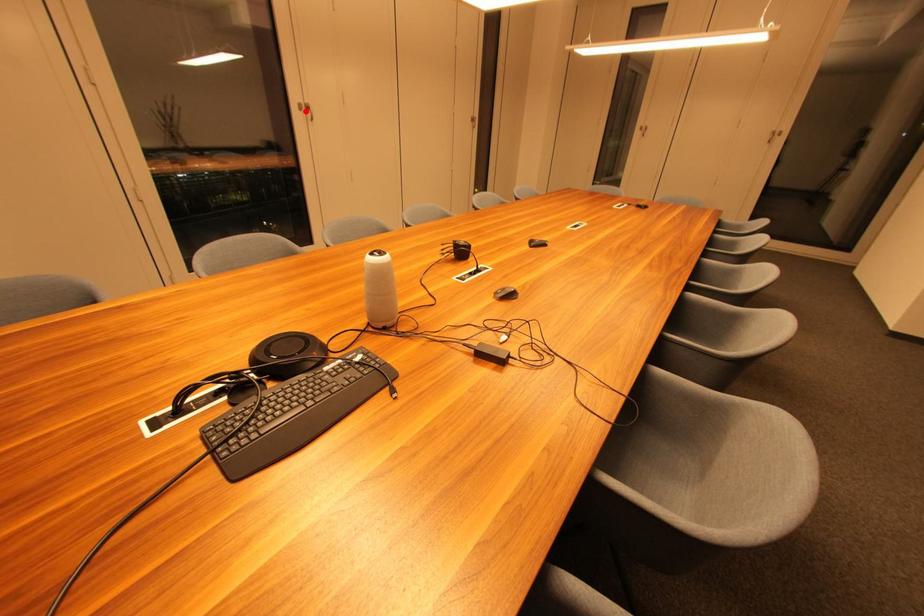
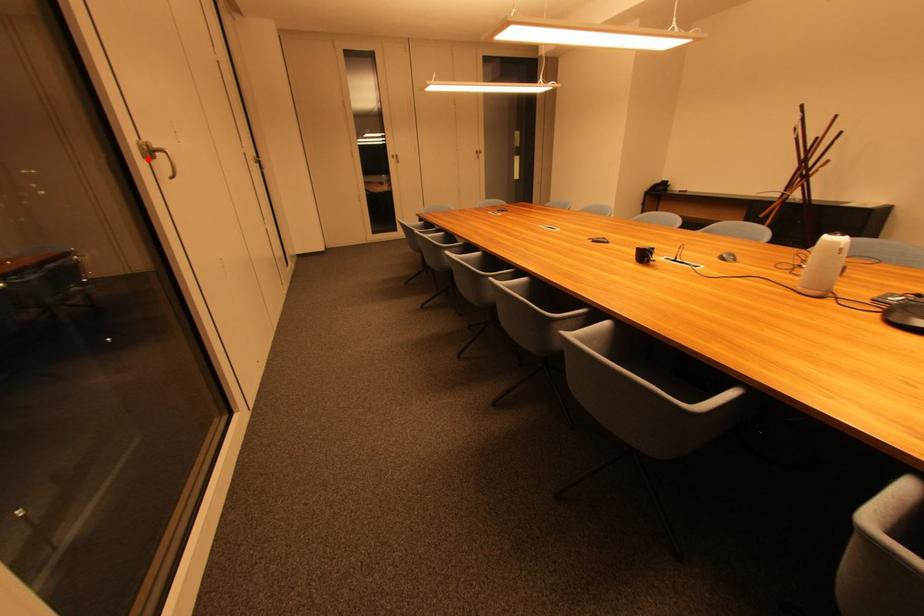
I am providing you with two images of the same scene from different viewpoints. A red point is marked on the first image and another point is marked on the second image. Is the marked point in image1 the same physical position as the marked point in image2?

Yes